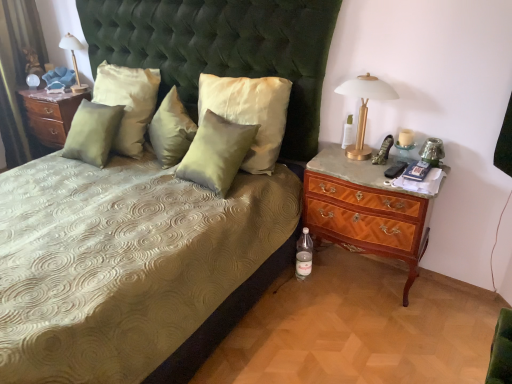
Where is `vacant space in front of clear glass bottle at right, which is counted as the second bottle, starting from the left`? The height and width of the screenshot is (384, 512). vacant space in front of clear glass bottle at right, which is counted as the second bottle, starting from the left is located at coordinates (346, 163).